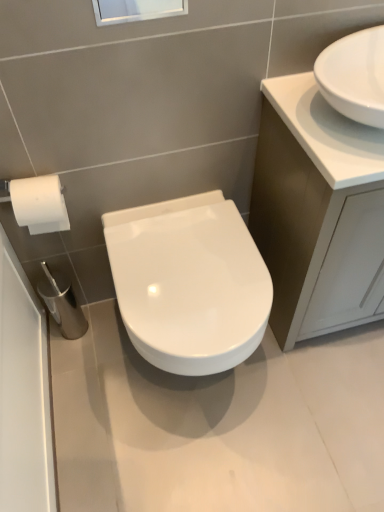
This screenshot has height=512, width=384. In order to click on free space in front of white glossy toilet at center in this screenshot , I will do `click(197, 462)`.